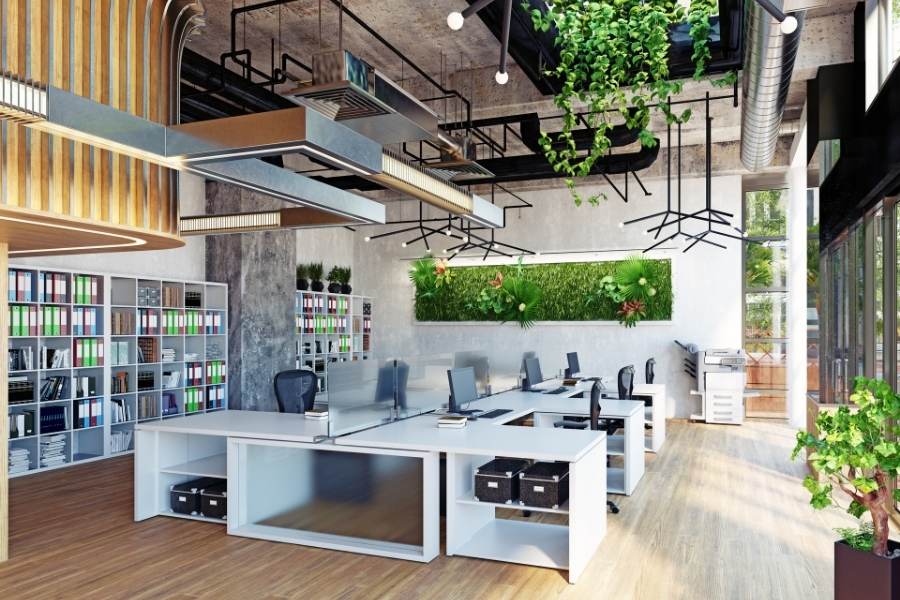
Image resolution: width=900 pixels, height=600 pixels. In order to click on chairs in this screenshot , I will do `click(300, 381)`, `click(595, 397)`, `click(624, 376)`, `click(654, 365)`.